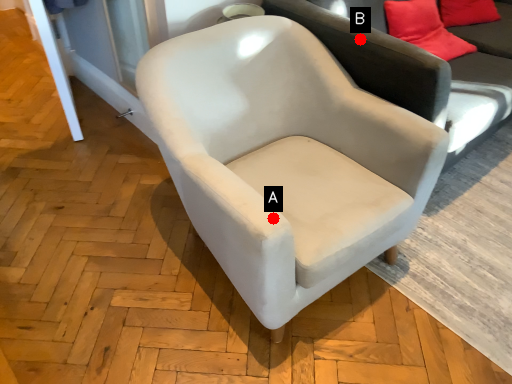
Question: Two points are circled on the image, labeled by A and B beside each circle. Which point is closer to the camera?

Choices:
 (A) A is closer
 (B) B is closer

Answer: (A)